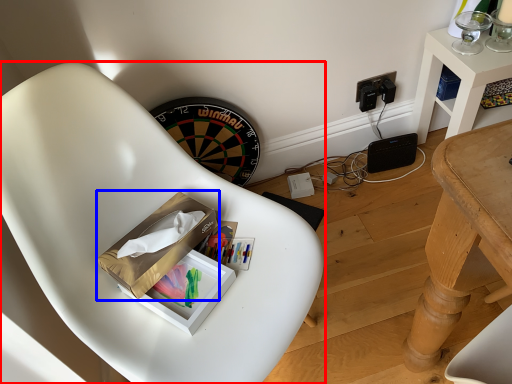
Question: Which of the following is the closest to the observer, chair (highlighted by a red box) or cardboard box (highlighted by a blue box)?

Choices:
 (A) chair
 (B) cardboard box

Answer: (A)